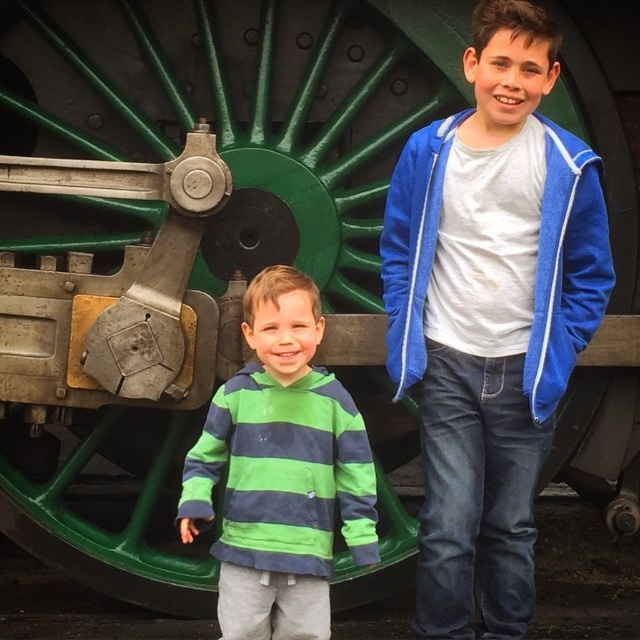
Question: Where is green striped hoodie at center located in relation to blue fleece jacket at upper right in the image?

Choices:
 (A) above
 (B) below

Answer: (B)

Question: Does green striped hoodie at center have a larger size compared to blue fleece jacket at upper right?

Choices:
 (A) yes
 (B) no

Answer: (A)

Question: Can you confirm if green striped hoodie at center is smaller than blue fleece jacket at upper right?

Choices:
 (A) yes
 (B) no

Answer: (B)